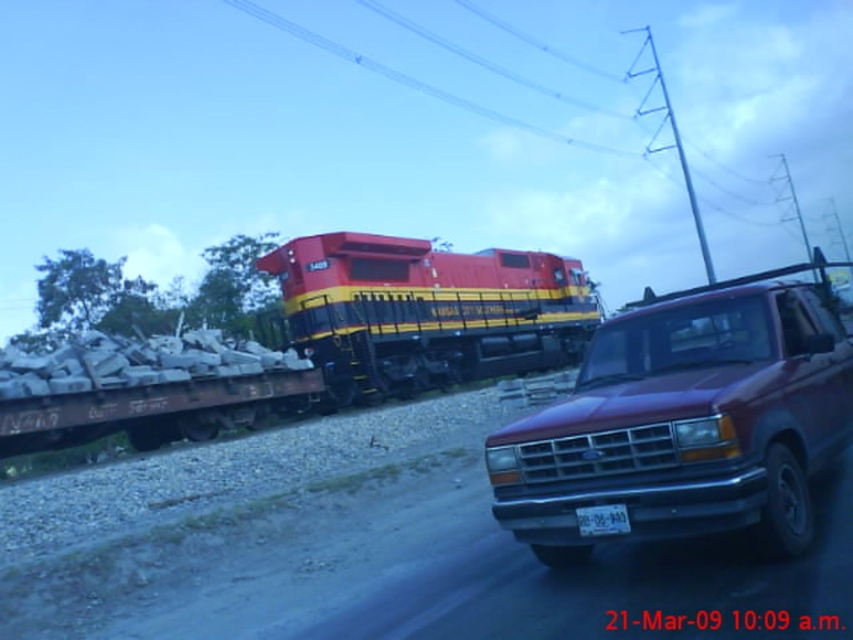
Who is shorter, maroon metallic truck at right or matte black truck at center?

Standing shorter between the two is maroon metallic truck at right.

Is point (555, 513) more distant than point (521, 260)?

No, (555, 513) is in front of (521, 260).

You are a GUI agent. You are given a task and a screenshot of the screen. Output one action in this format:
    pyautogui.click(x=<x>, y=<y>)
    Task: Click on the maroon metallic truck at right
    The image size is (853, 640).
    Given the screenshot: What is the action you would take?
    pyautogui.click(x=688, y=420)

Who is lower down, matte black truck at center or white plastic license plate at center?

Positioned lower is white plastic license plate at center.

Is matte black truck at center to the left of white plastic license plate at center from the viewer's perspective?

In fact, matte black truck at center is to the right of white plastic license plate at center.

Image resolution: width=853 pixels, height=640 pixels. What do you see at coordinates (427, 310) in the screenshot?
I see `matte black truck at center` at bounding box center [427, 310].

This screenshot has height=640, width=853. Identify the location of matte black truck at center. (427, 310).

Which of these two, red/yellow/black locomotive at center or matte black truck at center, stands shorter?

matte black truck at center

Can you confirm if red/yellow/black locomotive at center is shorter than matte black truck at center?

No.

Describe the element at coordinates (312, 344) in the screenshot. This screenshot has height=640, width=853. I see `red/yellow/black locomotive at center` at that location.

Identify the location of red/yellow/black locomotive at center. Image resolution: width=853 pixels, height=640 pixels. (312, 344).